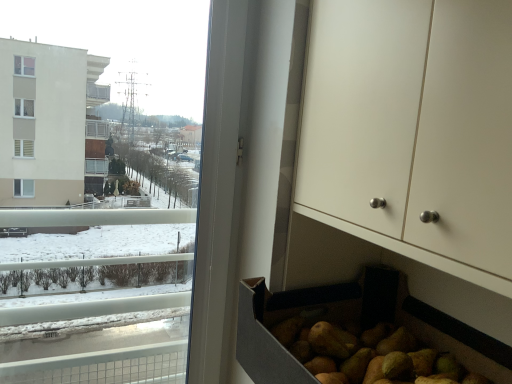
Question: From a real-world perspective, relative to transparent glass window at left, is white matte cabinet at lower right vertically above or below?

Choices:
 (A) above
 (B) below

Answer: (A)

Question: Do you think white matte cabinet at lower right is within transparent glass window at left, or outside of it?

Choices:
 (A) inside
 (B) outside

Answer: (B)

Question: Is white matte cabinet at lower right in front of or behind transparent glass window at left in the image?

Choices:
 (A) front
 (B) behind

Answer: (A)

Question: Is transparent glass window at left inside the boundaries of white matte cabinet at lower right, or outside?

Choices:
 (A) outside
 (B) inside

Answer: (A)

Question: Considering their positions, is transparent glass window at left located in front of or behind white matte cabinet at lower right?

Choices:
 (A) behind
 (B) front

Answer: (A)

Question: From the image's perspective, is transparent glass window at left above or below white matte cabinet at lower right?

Choices:
 (A) above
 (B) below

Answer: (B)

Question: Considering the relative positions of transparent glass window at left and white matte cabinet at lower right in the image provided, is transparent glass window at left to the left or to the right of white matte cabinet at lower right?

Choices:
 (A) right
 (B) left

Answer: (B)